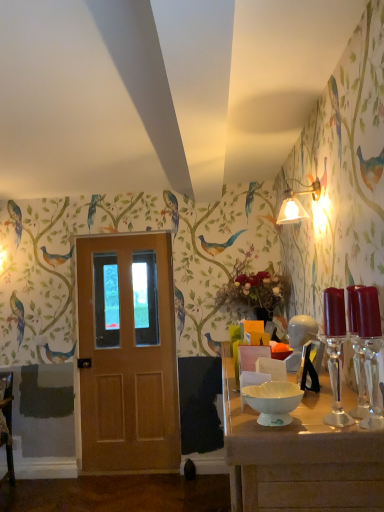
What are the coordinates of `blank space situated above wooden door at center (from a real-world perspective)` in the screenshot? It's located at point(121,236).